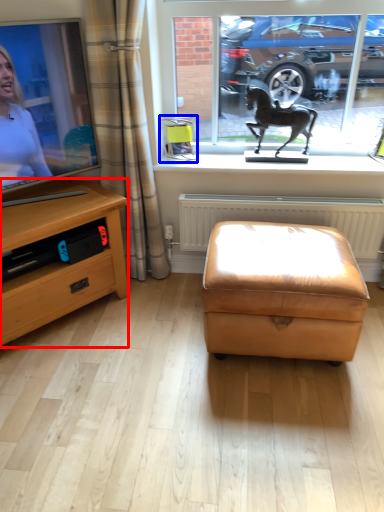
Question: Among these objects, which one is farthest to the camera, desk (highlighted by a red box) or picture frame (highlighted by a blue box)?

Choices:
 (A) desk
 (B) picture frame

Answer: (B)